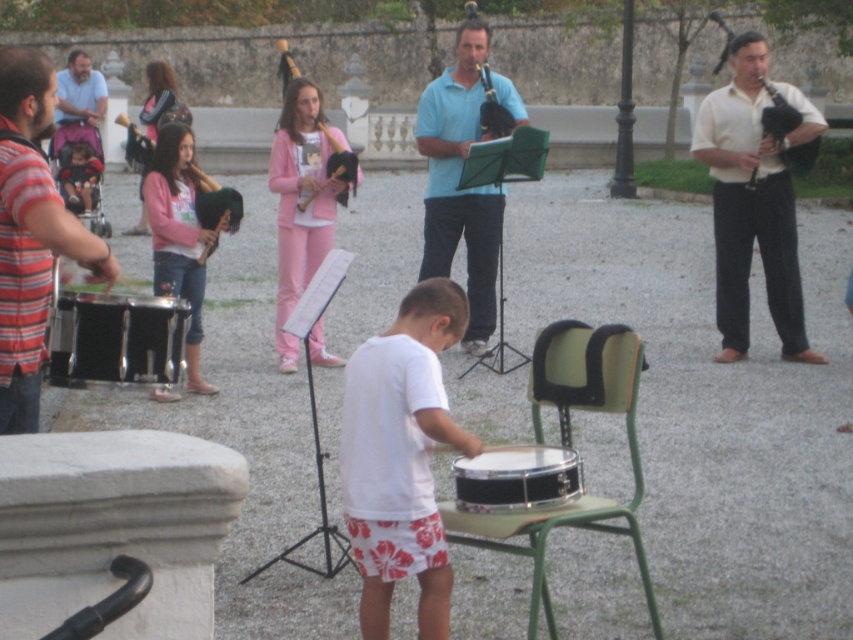
Is point (422, 372) farther from camera compared to point (331, 177)?

No, it is in front of (331, 177).

Does white cotton shirt at center appear on the left side of matte wood flute at upper center?

In fact, white cotton shirt at center is to the right of matte wood flute at upper center.

Measure the distance between white cotton shirt at center and camera.

white cotton shirt at center and camera are 19.82 feet apart.

In order to click on white cotton shirt at center in this screenshot , I will do `click(401, 456)`.

Does blue matte bagpipe at center have a lesser height compared to pink fabric jacket at upper left?

No, blue matte bagpipe at center is not shorter than pink fabric jacket at upper left.

Measure the distance between blue matte bagpipe at center and pink fabric jacket at upper left.

They are 6.40 feet apart.

Find the location of a particular element. The height and width of the screenshot is (640, 853). blue matte bagpipe at center is located at coordinates (459, 176).

Is point (22, 122) positioned in front of point (550, 460)?

That is False.

Who is taller, striped cotton shirt at left or black drum at center?

Standing taller between the two is striped cotton shirt at left.

Is point (35, 276) closer to viewer compared to point (517, 484)?

No, it is behind (517, 484).

Identify the location of striped cotton shirt at left. (32, 234).